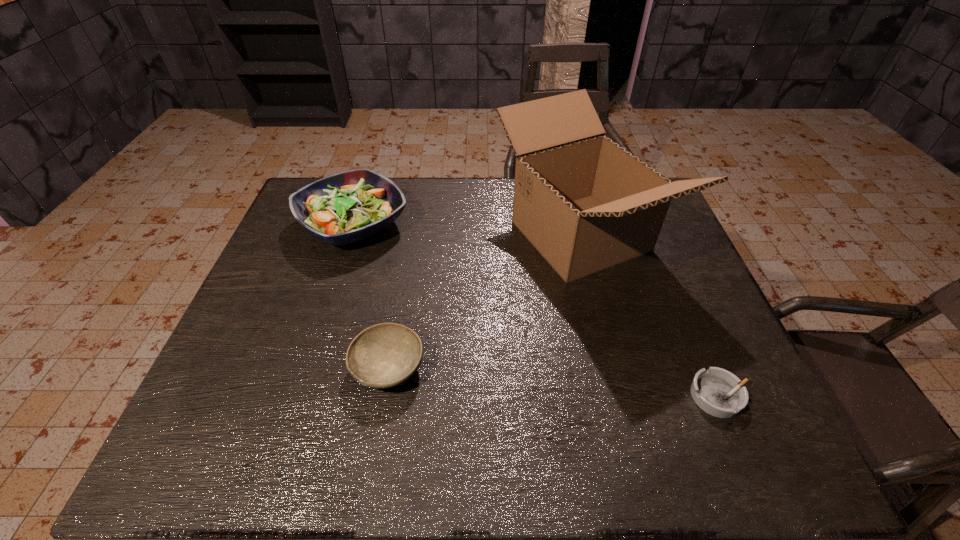
Image resolution: width=960 pixels, height=540 pixels. I want to click on object that is positioned at the left edge, so click(349, 206).

Locate an element on the screen. box present at the right edge is located at coordinates (585, 203).

The width and height of the screenshot is (960, 540). Identify the location of ashtray that is at the right edge. (718, 392).

You are a GUI agent. You are given a task and a screenshot of the screen. Output one action in this format:
    pyautogui.click(x=<x>, y=<y>)
    Task: Click on the object that is at the far left corner
    
    Given the screenshot: What is the action you would take?
    pyautogui.click(x=349, y=206)

The height and width of the screenshot is (540, 960). In order to click on object situated at the far right corner in this screenshot , I will do tap(585, 203).

Locate an element on the screen. free region at the far edge of the desktop is located at coordinates (482, 208).

This screenshot has width=960, height=540. I want to click on vacant position at the left edge of the desktop, so click(308, 276).

This screenshot has width=960, height=540. Identify the location of vacant space at the right edge of the desktop. (707, 425).

Identify the location of unoccupied position between the third tallest object and the box. (484, 302).

Locate an element on the screen. The image size is (960, 540). free space between the bowl and the second tallest object is located at coordinates (371, 296).